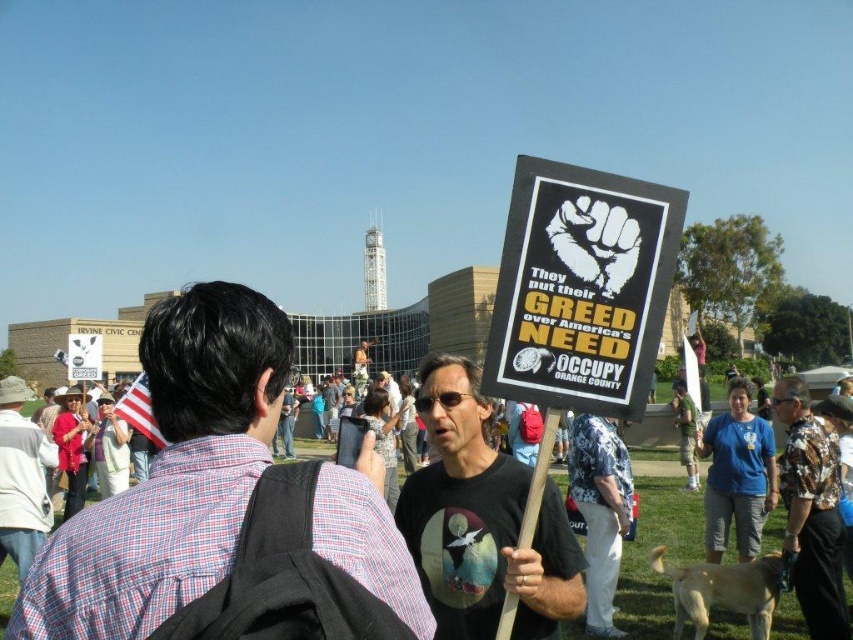
Question: Is floral shirt at center positioned before white hat at center?

Choices:
 (A) yes
 (B) no

Answer: (A)

Question: Is black t-shirt at center further to camera compared to floral shirt at center?

Choices:
 (A) no
 (B) yes

Answer: (A)

Question: Which object is positioned closest to the floral shirt at center?

Choices:
 (A) white hat at center
 (B) black t-shirt at center
 (C) hawaiian shirt at center
 (D) plaid shirt at center

Answer: (C)

Question: Which of the following is the farthest from the observer?

Choices:
 (A) (602, 589)
 (B) (801, 461)

Answer: (A)

Question: Is black t-shirt at center further to the viewer compared to floral shirt at center?

Choices:
 (A) no
 (B) yes

Answer: (A)

Question: Which object is positioned closest to the plaid shirt at center?

Choices:
 (A) white hat at center
 (B) black t-shirt at center
 (C) hawaiian shirt at center
 (D) floral shirt at center

Answer: (B)